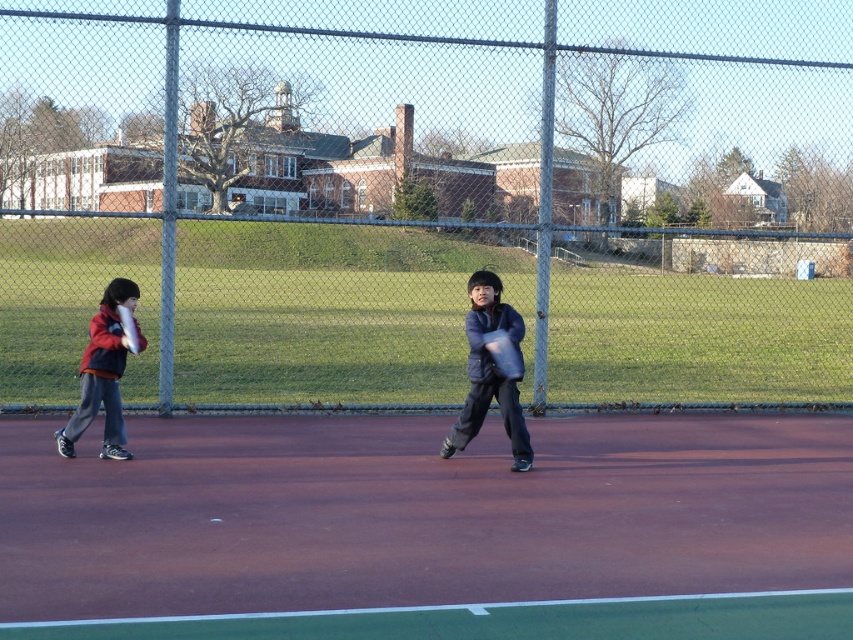
Question: Can you confirm if smooth clay tennis court at center is thinner than red fleece jacket at left?

Choices:
 (A) yes
 (B) no

Answer: (A)

Question: Which object is farther from the camera taking this photo?

Choices:
 (A) red fleece jacket at left
 (B) smooth clay tennis court at center
 (C) metal chain-link fence at center
 (D) translucent white racket at left

Answer: (C)

Question: Can you confirm if dark blue jacket at center is wider than red fleece jacket at left?

Choices:
 (A) no
 (B) yes

Answer: (A)

Question: Where is dark blue jacket at center located in relation to red fleece jacket at left in the image?

Choices:
 (A) left
 (B) right

Answer: (B)

Question: Which object appears closest to the camera in this image?

Choices:
 (A) smooth clay tennis court at center
 (B) metal chain-link fence at center
 (C) red fleece jacket at left
 (D) translucent white racket at left

Answer: (A)

Question: Which object is farther from the camera taking this photo?

Choices:
 (A) translucent white racket at left
 (B) smooth clay tennis court at center

Answer: (A)